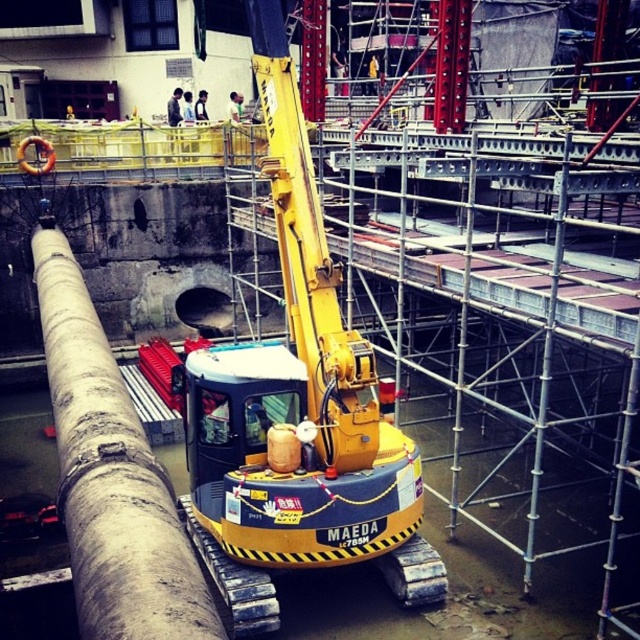
Question: Can you confirm if yellow rubbermaid excavator at center is positioned to the left of gray concrete pipe at center?

Choices:
 (A) yes
 (B) no

Answer: (B)

Question: Is yellow rubbermaid excavator at center positioned in front of gray concrete pipe at center?

Choices:
 (A) no
 (B) yes

Answer: (A)

Question: Which object appears closest to the camera in this image?

Choices:
 (A) gray concrete pipe at center
 (B) yellow rubbermaid excavator at center

Answer: (A)

Question: Is yellow rubbermaid excavator at center wider than gray concrete pipe at center?

Choices:
 (A) yes
 (B) no

Answer: (B)

Question: Which point is closer to the camera?

Choices:
 (A) yellow rubbermaid excavator at center
 (B) gray concrete pipe at center

Answer: (B)